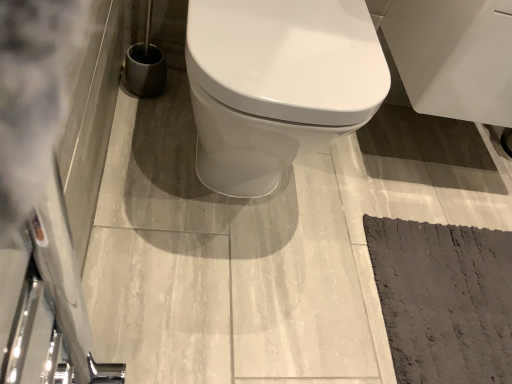
Identify the location of free space to the back side of dark gray textured mat at lower right. (432, 175).